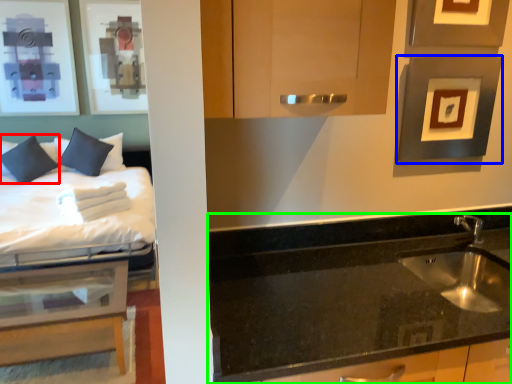
Question: Based on their relative distances, which object is nearer to pillow (highlighted by a red box)? Choose from picture frame (highlighted by a blue box) and countertop (highlighted by a green box).

Choices:
 (A) picture frame
 (B) countertop

Answer: (B)